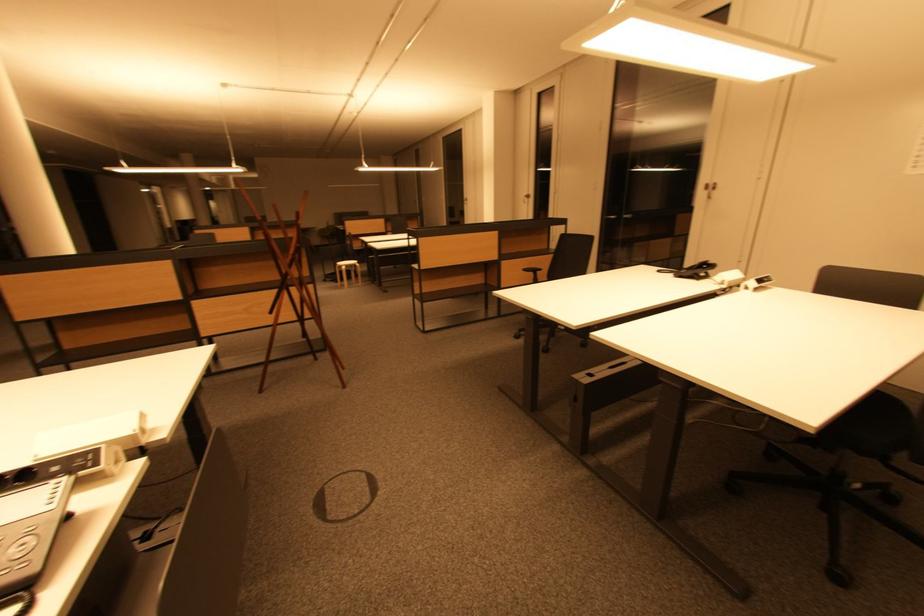
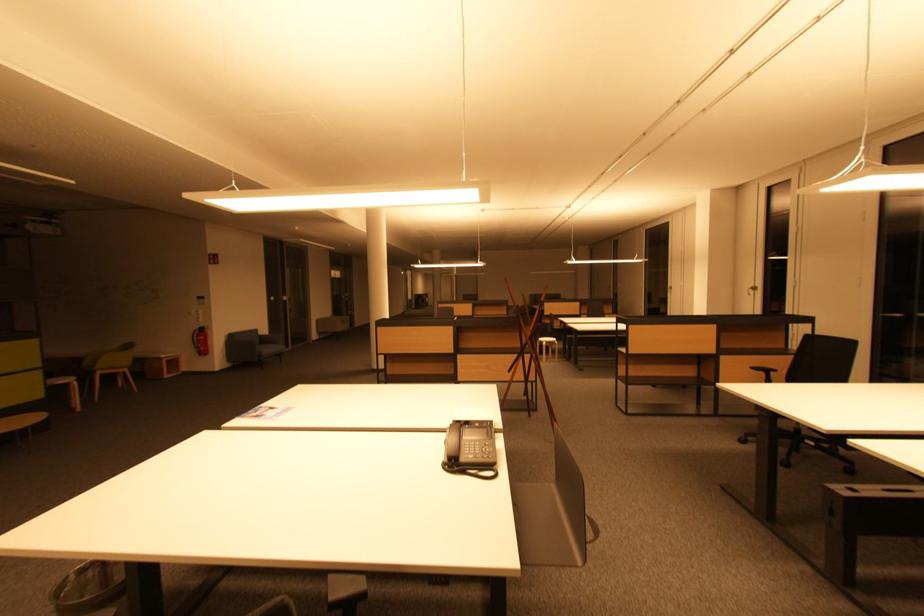
Find the pixel in the second image that matches (347,270) in the first image.

(549, 345)